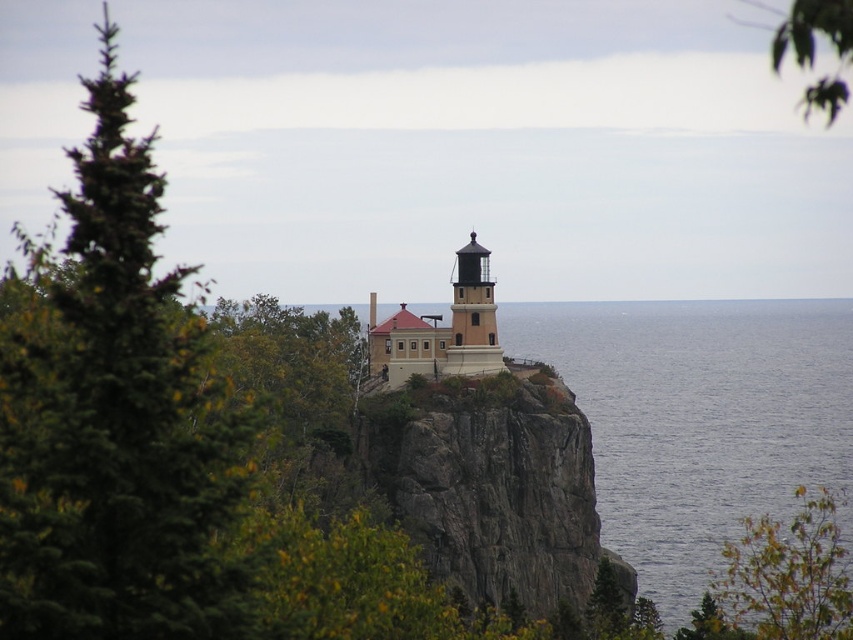
Question: Among these objects, which one is nearest to the camera?

Choices:
 (A) green leafy tree at upper right
 (B) blue water at cliff edge
 (C) beige stone lighthouse at center

Answer: (A)

Question: Which point is closer to the camera?

Choices:
 (A) beige stone lighthouse at center
 (B) green needle-like tree at left

Answer: (B)

Question: Can you confirm if blue water at cliff edge is smaller than matte black lighthouse at center?

Choices:
 (A) yes
 (B) no

Answer: (B)

Question: Does beige stone lighthouse at center have a larger size compared to matte black lighthouse at center?

Choices:
 (A) yes
 (B) no

Answer: (A)

Question: Which point is closer to the camera?

Choices:
 (A) green needle-like tree at left
 (B) matte black lighthouse at center
 (C) blue water at cliff edge

Answer: (A)

Question: Is blue water at cliff edge to the right of green leafy tree at upper right from the viewer's perspective?

Choices:
 (A) yes
 (B) no

Answer: (B)